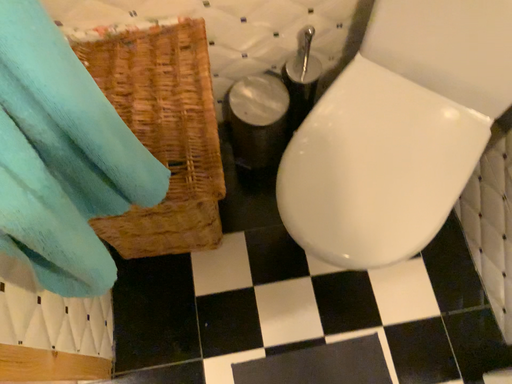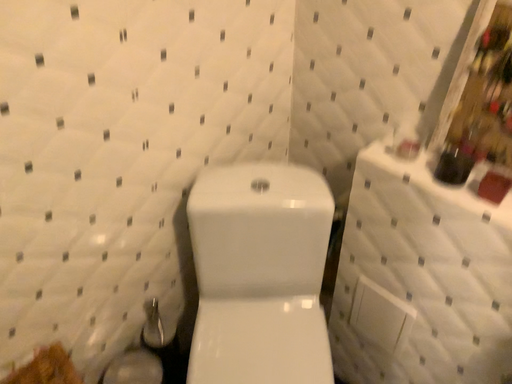
Question: Which way did the camera rotate in the video?

Choices:
 (A) rotated downward
 (B) rotated upward

Answer: (B)